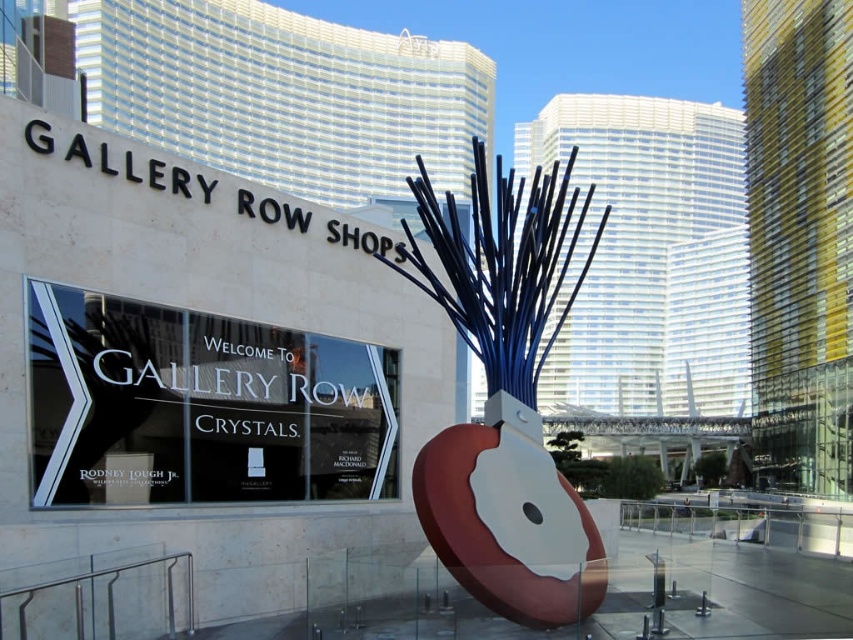
Which is above, white glass sign at center or matte blue metal spikes at center?

matte blue metal spikes at center is higher up.

Is point (183, 472) positioned after point (538, 572)?

Yes, it is.

This screenshot has height=640, width=853. What do you see at coordinates (200, 406) in the screenshot?
I see `white glass sign at center` at bounding box center [200, 406].

Locate an element on the screen. This screenshot has width=853, height=640. white glass sign at center is located at coordinates (200, 406).